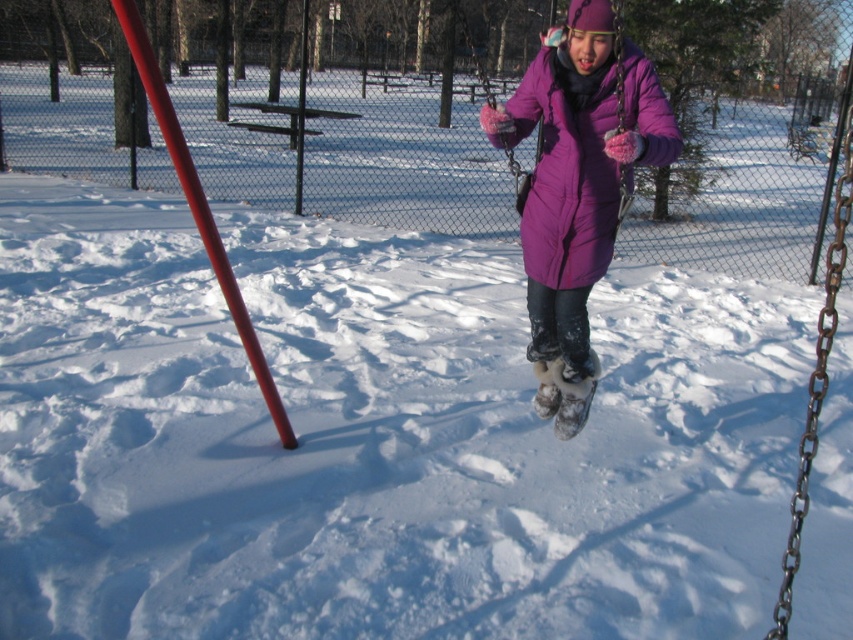
Who is higher up, purple down jacket at center or smooth glossy pole at left?

smooth glossy pole at left is above.

Can you confirm if purple down jacket at center is shorter than smooth glossy pole at left?

No.

Locate an element on the screen. The image size is (853, 640). purple down jacket at center is located at coordinates (577, 188).

Where is `purple down jacket at center`? purple down jacket at center is located at coordinates pyautogui.click(x=577, y=188).